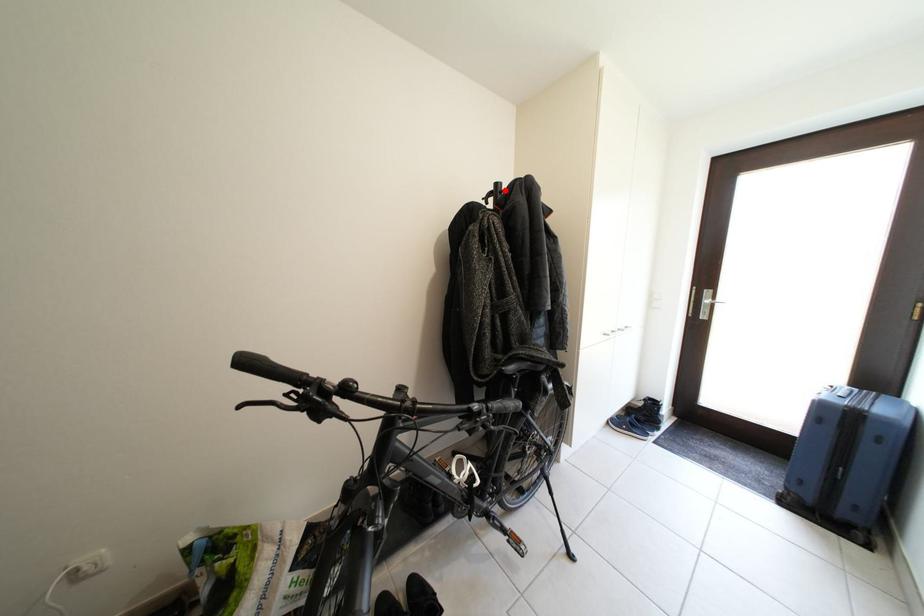
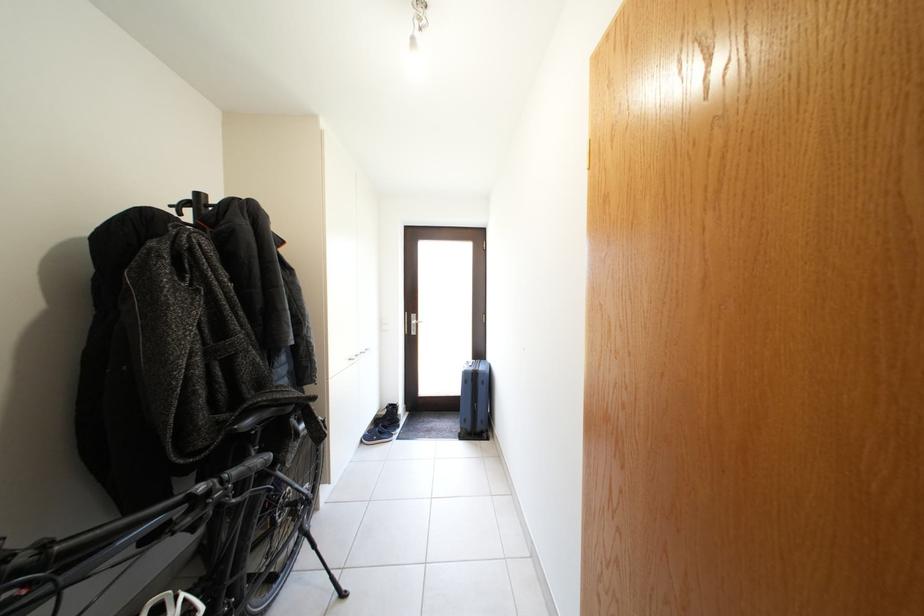
Find the pixel in the second image that matches the highlighted location in the first image.

(205, 200)